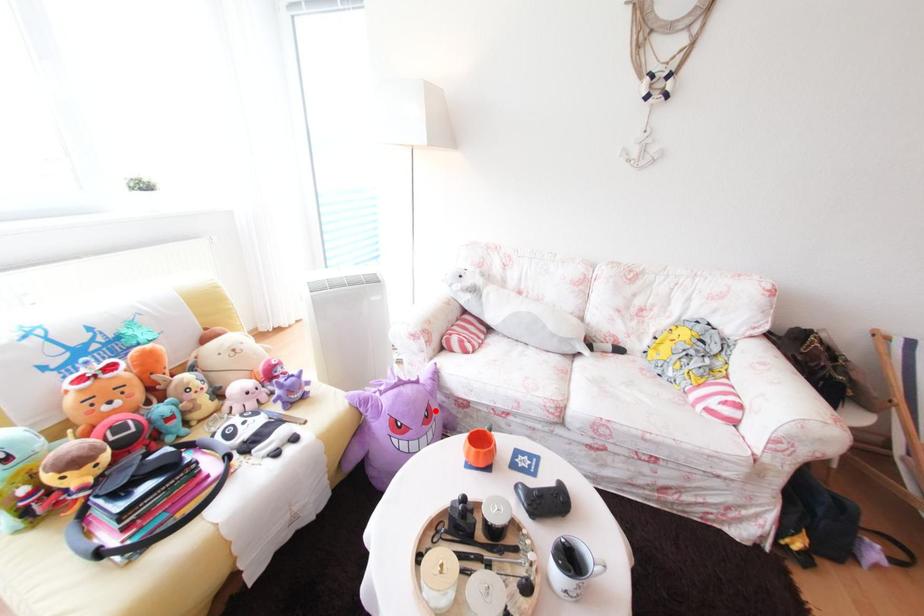
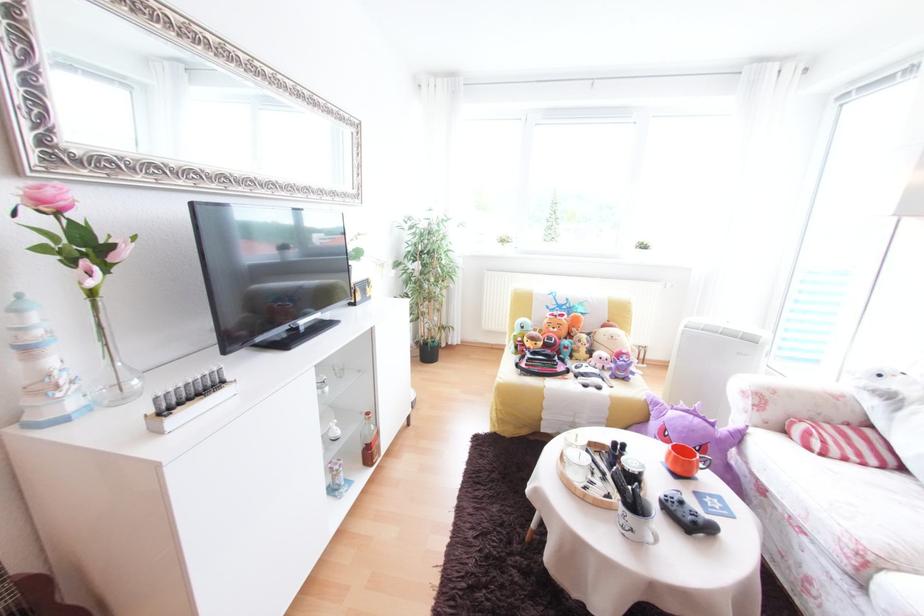
Locate, in the second image, the point that corresponds to the highlighted location in the first image.

(709, 447)